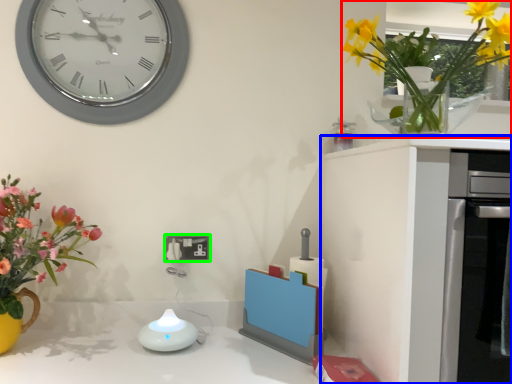
Question: Which object is positioned farthest from floral arrangement (highlighted by a red box)? Select from cabinetry (highlighted by a blue box) and electric outlet (highlighted by a green box).

Choices:
 (A) cabinetry
 (B) electric outlet

Answer: (B)